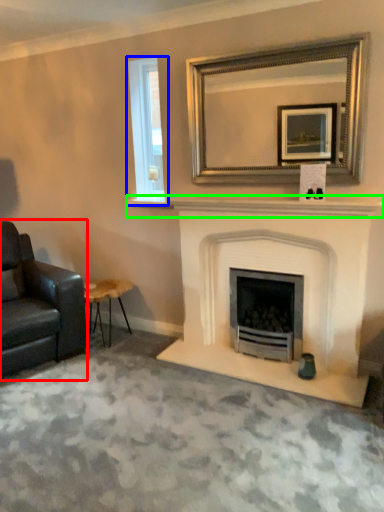
Question: Considering the real-world distances, which object is farthest from chair (highlighted by a red box)? window (highlighted by a blue box) or mantle (highlighted by a green box)?

Choices:
 (A) window
 (B) mantle

Answer: (A)